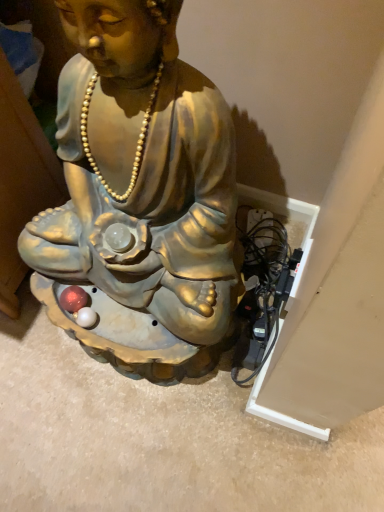
Question: Should I look upward or downward to see gold glossy statue at center?

Choices:
 (A) down
 (B) up

Answer: (B)